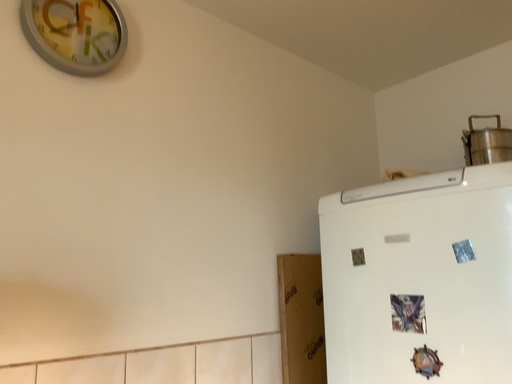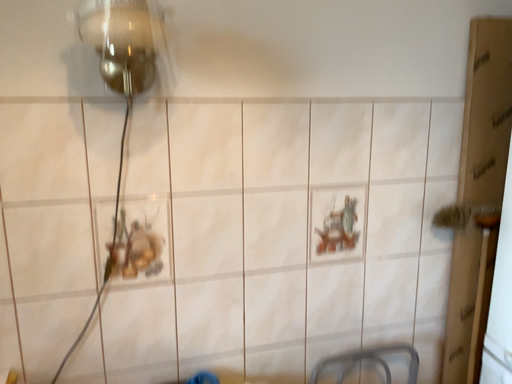
Question: How did the camera likely rotate when shooting the video?

Choices:
 (A) rotated right
 (B) rotated left

Answer: (B)